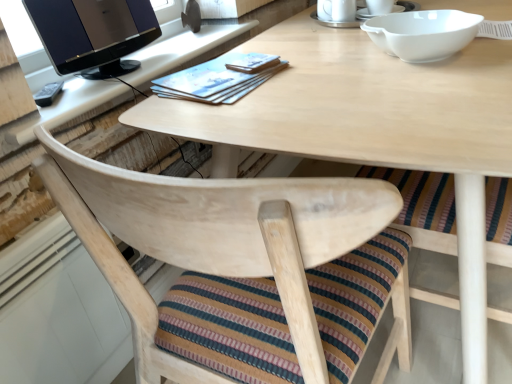
At what (x,y) coordinates should I click in order to perform the action: click on vacant area in front of white glossy bowl at upper right. Please return your answer as a coordinate pair (x, y). Looking at the image, I should click on (426, 89).